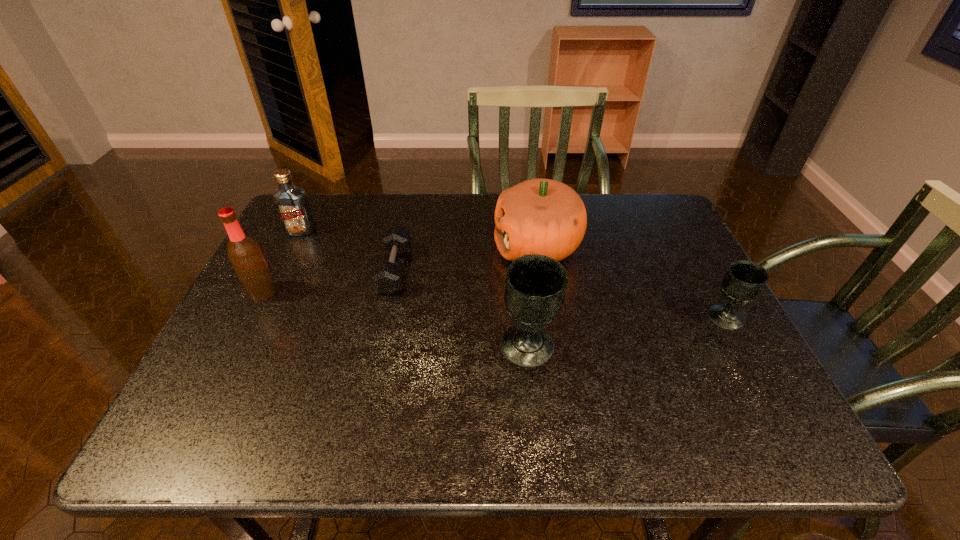
This screenshot has height=540, width=960. In order to click on free spot between the vodka and the pumpkin in this screenshot , I will do `click(420, 239)`.

At what (x,y) coordinates should I click in order to perform the action: click on vacant region between the vodka and the third object from left to right. Please return your answer as a coordinate pair (x, y). This screenshot has height=540, width=960. Looking at the image, I should click on (348, 251).

Where is `free space between the dumbbell and the pumpkin`? Image resolution: width=960 pixels, height=540 pixels. free space between the dumbbell and the pumpkin is located at coordinates (466, 259).

The width and height of the screenshot is (960, 540). Find the location of `free space that is in between the vodka and the beer bottle`. free space that is in between the vodka and the beer bottle is located at coordinates (281, 261).

Locate an element on the screen. free space between the dumbbell and the beer bottle is located at coordinates (328, 281).

Image resolution: width=960 pixels, height=540 pixels. I want to click on empty space that is in between the taller chalice and the vodka, so click(x=414, y=288).

This screenshot has width=960, height=540. What are the coordinates of `the third closest object to the pumpkin` in the screenshot? It's located at (744, 281).

The width and height of the screenshot is (960, 540). Find the location of `object that is the nearest to the pumpkin`. object that is the nearest to the pumpkin is located at coordinates (535, 288).